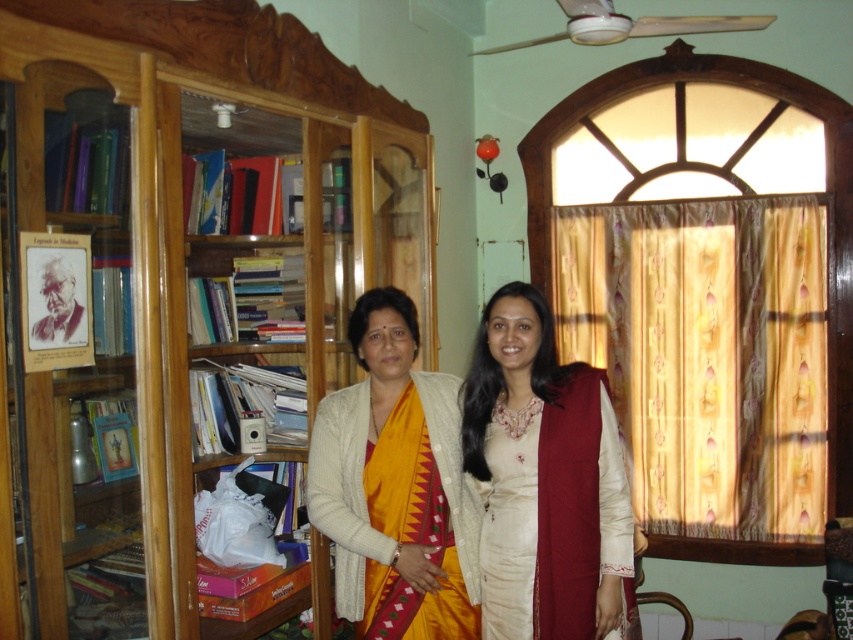
Who is positioned more to the left, yellow silk saree at center or wooden bookshelf at left?

wooden bookshelf at left

Is the position of yellow silk saree at center more distant than that of wooden bookshelf at left?

Yes, it is.

Which is in front, point (326, 492) or point (157, 106)?

Point (157, 106)

I want to click on yellow silk saree at center, so click(x=395, y=484).

Is point (529, 406) closer to camera compared to point (184, 621)?

No.

At what (x,y) coordinates should I click in order to perform the action: click on beige satin kurta with maroon dupatta at center. Please return your answer as a coordinate pair (x, y). The width and height of the screenshot is (853, 640). Looking at the image, I should click on (544, 481).

Can you confirm if beige satin kurta with maroon dupatta at center is shorter than yellow silk saree at center?

Indeed, beige satin kurta with maroon dupatta at center has a lesser height compared to yellow silk saree at center.

Which is more to the left, beige satin kurta with maroon dupatta at center or yellow silk saree at center?

yellow silk saree at center is more to the left.

This screenshot has height=640, width=853. What are the coordinates of `beige satin kurta with maroon dupatta at center` in the screenshot? It's located at (544, 481).